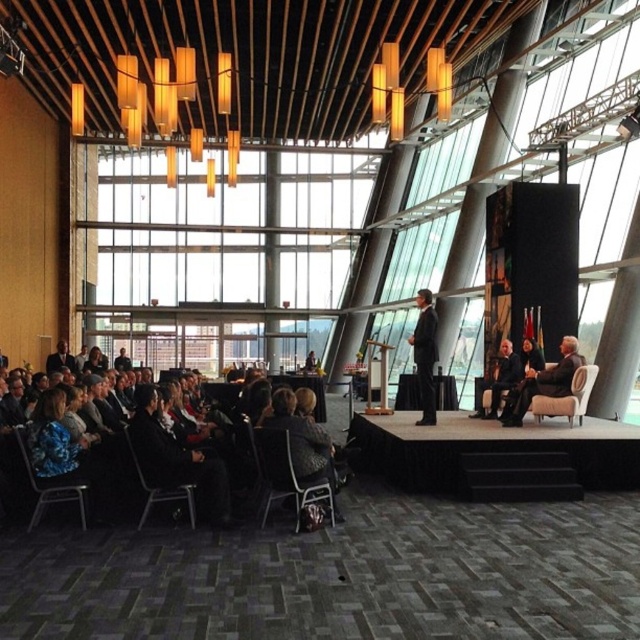
You are standing at the entrance of the venue and see the point marked at coordinates [118,452]. What object is located at that point?

The point at coordinates [118,452] corresponds to the dark gray fabric chairs at lower left.

You are arranging a small meeting in this venue and need to seat three people. You have two chairs available, the dark gray fabric chairs at lower left and the light beige leather chair at right. Which chair can accommodate a wider person comfortably?

The dark gray fabric chairs at lower left have a greater width than the light beige leather chair at right, so they can accommodate a wider person more comfortably.

You are an event planner arranging seating for attendees. You have two chairs available for placement in the venue. The dark gray fabric chairs at lower left and the light beige leather chair at right. Which chair would you choose if you need a larger seating area for comfort?

The dark gray fabric chairs at lower left is bigger than the light beige leather chair at right, so it provides a larger seating area for comfort.